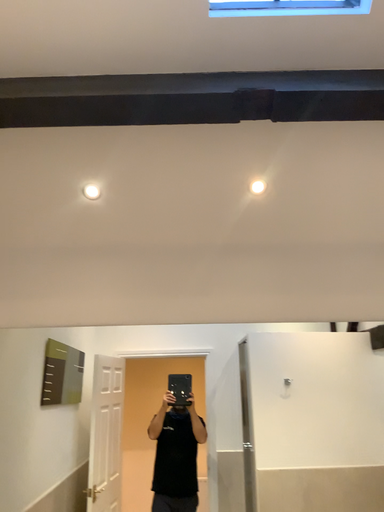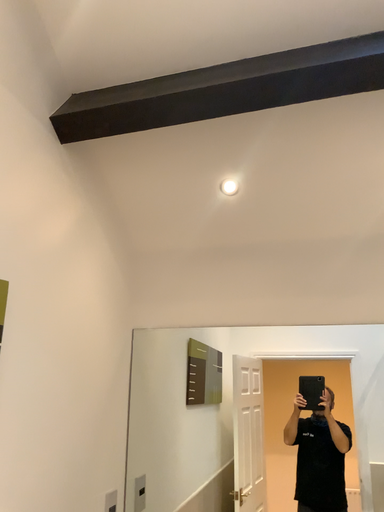
Question: Which way did the camera rotate in the video?

Choices:
 (A) rotated right
 (B) rotated left

Answer: (B)